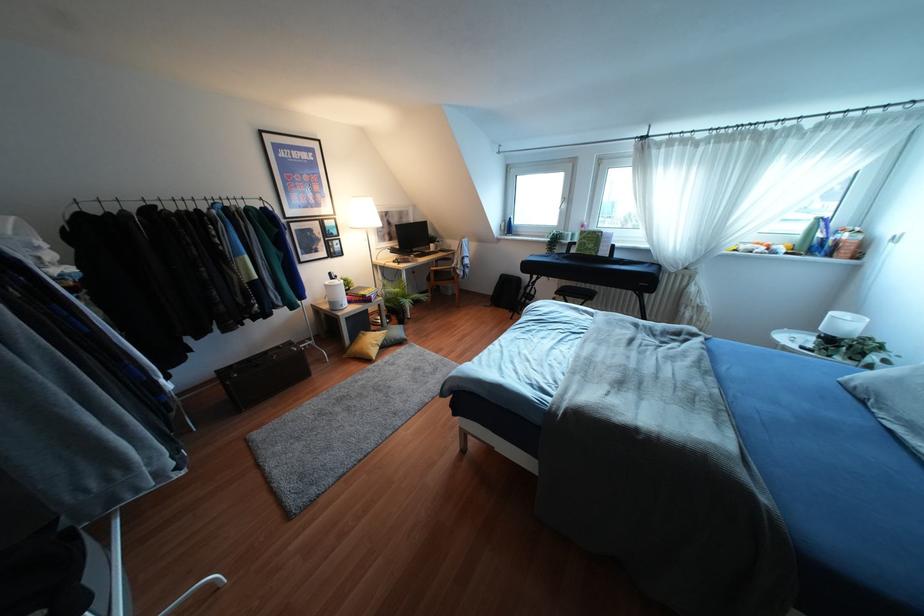
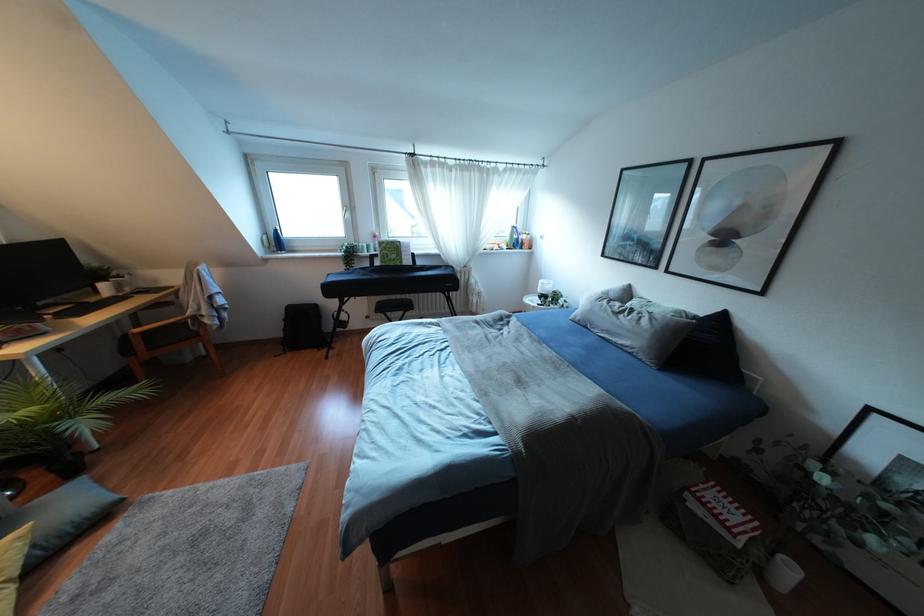
The point at [563,206] is marked in the first image. Where is the corresponding point in the second image?

(346, 215)